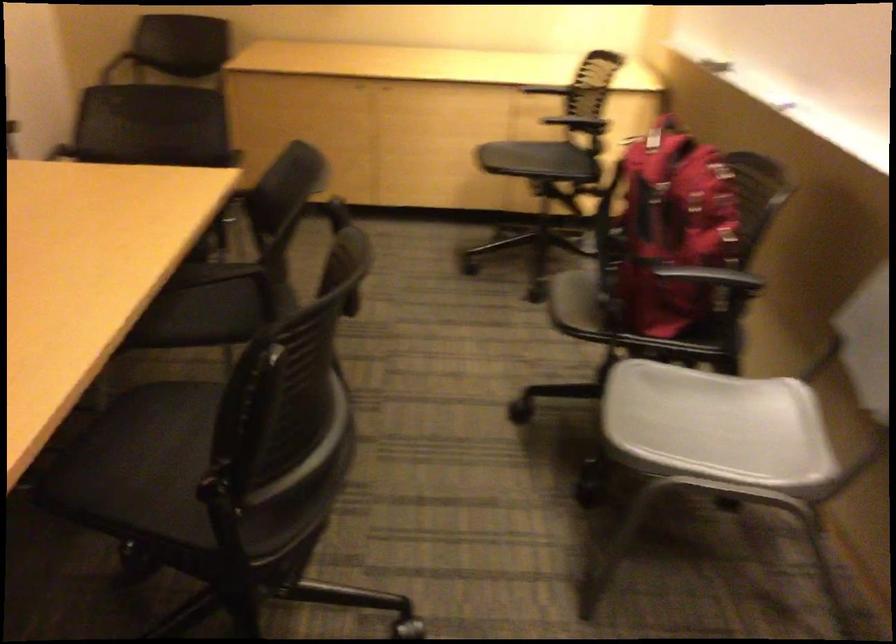
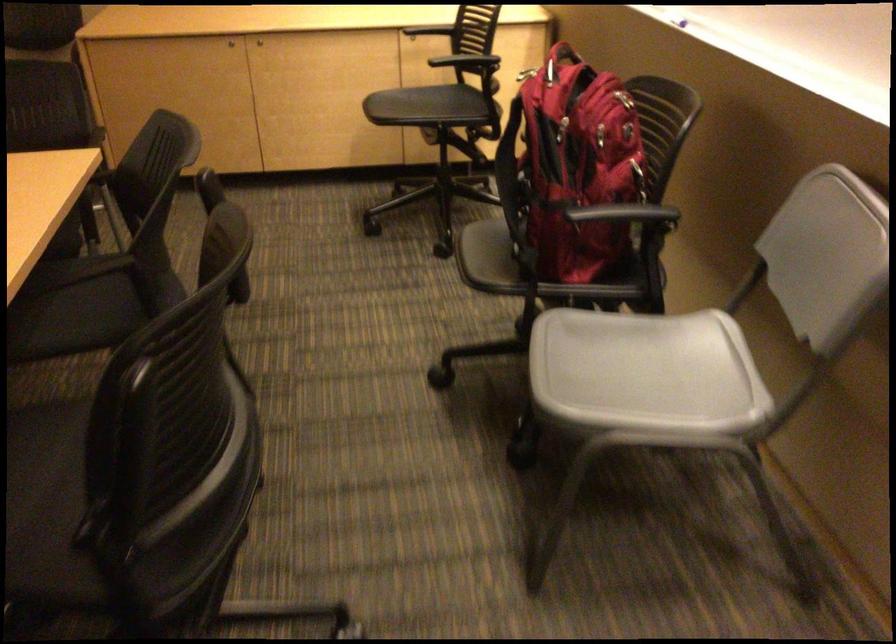
The point at (364,86) is marked in the first image. Where is the corresponding point in the second image?

(230, 44)